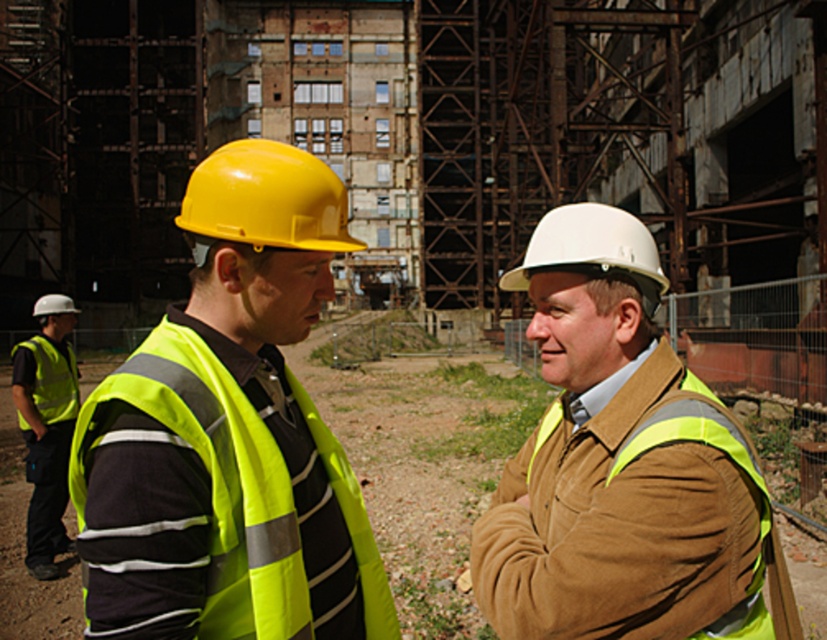
Question: Which point is farther to the camera?

Choices:
 (A) high visibility vest at left
 (B) high-visibility fabric safety vest at left

Answer: (A)

Question: Can you confirm if yellow hard hat at center is positioned above white matte hard hat at center?

Choices:
 (A) yes
 (B) no

Answer: (A)

Question: Can you confirm if high visibility fabric safety vest at left is bigger than matte yellow helmet at left?

Choices:
 (A) yes
 (B) no

Answer: (B)

Question: Among these points, which one is farthest from the camera?

Choices:
 (A) (582, 221)
 (B) (25, 436)
 (C) (39, 372)
 (D) (185, 209)

Answer: (C)

Question: Can you confirm if matte yellow hard hat at center is bigger than high visibility fabric safety vest at left?

Choices:
 (A) no
 (B) yes

Answer: (B)

Question: Which point is farther to the camera?

Choices:
 (A) (208, 186)
 (B) (63, 301)

Answer: (B)